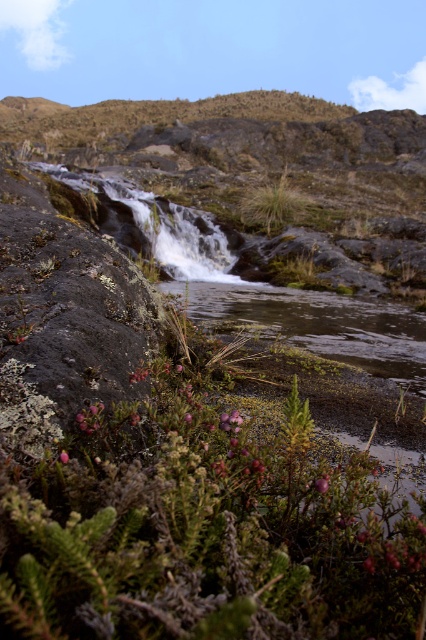
Can you confirm if purple fuzzy berries at bottom center is smaller than pink matte flower at center?

No, purple fuzzy berries at bottom center is not smaller than pink matte flower at center.

The width and height of the screenshot is (426, 640). Find the location of `purple fuzzy berries at bottom center`. purple fuzzy berries at bottom center is located at coordinates (204, 531).

Between purple fuzzy berries at bottom center and pink matte flower at lower left, which one appears on the right side from the viewer's perspective?

Positioned to the right is purple fuzzy berries at bottom center.

Between point (131, 522) and point (60, 451), which one is positioned behind?

The point (60, 451) is more distant.

You are a GUI agent. You are given a task and a screenshot of the screen. Output one action in this format:
    pyautogui.click(x=<x>, y=<y>)
    Task: Click on the purple fuzzy berries at bottom center
    
    Given the screenshot: What is the action you would take?
    pyautogui.click(x=204, y=531)

Which is more to the right, green grass at center or pink matte flower at center?

Positioned to the right is green grass at center.

The height and width of the screenshot is (640, 426). In order to click on green grass at center in this screenshot , I will do `click(273, 205)`.

Which is in front, point (239, 212) or point (316, 483)?

Point (316, 483) is more forward.

This screenshot has height=640, width=426. Identify the location of green grass at center. (273, 205).